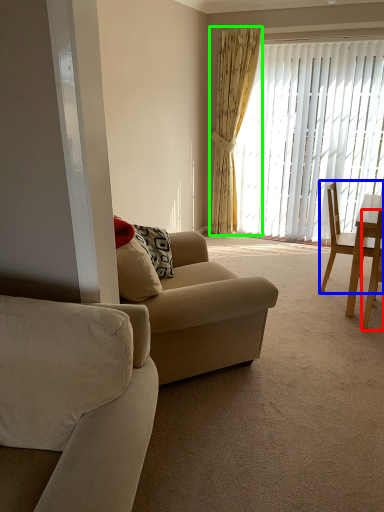
Question: Considering the real-world distances, which object is farthest from chair (highlighted by a red box)? chair (highlighted by a blue box) or curtain (highlighted by a green box)?

Choices:
 (A) chair
 (B) curtain

Answer: (B)